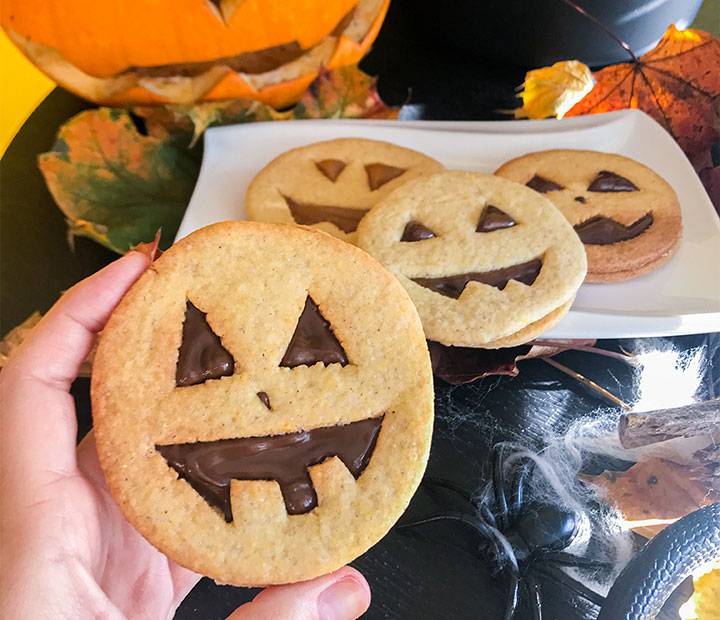
Locate an element on the screen. black table is located at coordinates (449, 48).